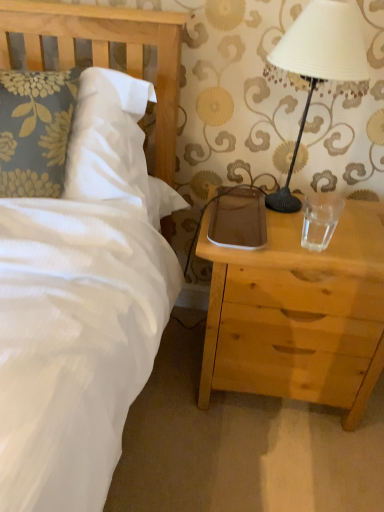
Question: From a real-world perspective, is wooden headboard at upper left positioned above or below transparent glass at right?

Choices:
 (A) above
 (B) below

Answer: (A)

Question: Looking at their shapes, would you say wooden headboard at upper left is wider or thinner than transparent glass at right?

Choices:
 (A) wide
 (B) thin

Answer: (A)

Question: Which object is positioned closest to the white matte lampshade at upper right?

Choices:
 (A) brown leather pad at right
 (B) light wood nightstand at right
 (C) transparent glass at right
 (D) wooden headboard at upper left

Answer: (A)

Question: Which object is the farthest from the brown leather pad at right?

Choices:
 (A) light wood nightstand at right
 (B) wooden headboard at upper left
 (C) transparent glass at right
 (D) white matte lampshade at upper right

Answer: (B)